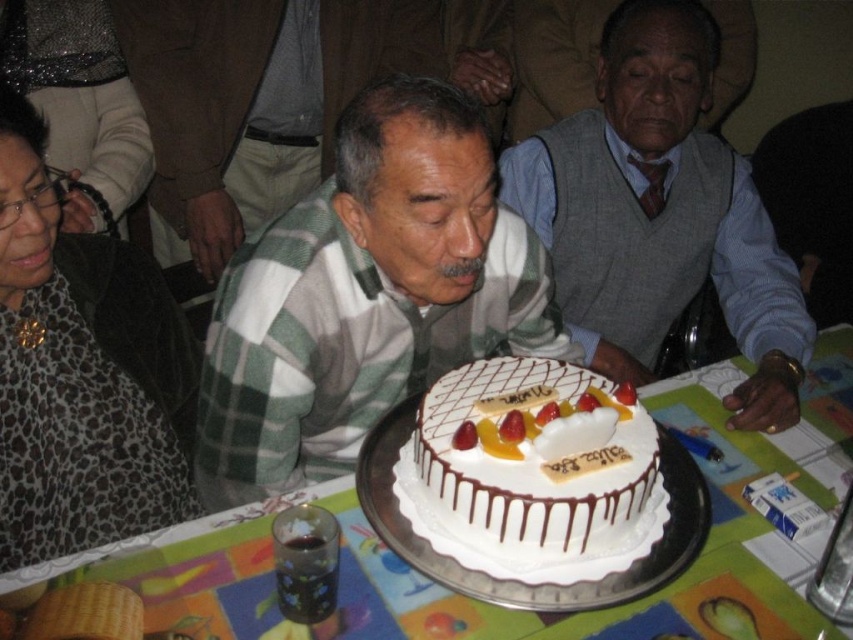
Is point (498, 243) closer to camera compared to point (428, 417)?

That is False.

The image size is (853, 640). What do you see at coordinates (364, 296) in the screenshot?
I see `white matte sweater at center` at bounding box center [364, 296].

You are a GUI agent. You are given a task and a screenshot of the screen. Output one action in this format:
    pyautogui.click(x=<x>, y=<y>)
    Task: Click on the white matte sweater at center
    
    Given the screenshot: What is the action you would take?
    pyautogui.click(x=364, y=296)

Can you confirm if gray sweater vest at center is wider than leopard print scarf at upper left?

Yes, gray sweater vest at center is wider than leopard print scarf at upper left.

Is point (596, 164) closer to camera compared to point (91, 260)?

No, it is not.

I want to click on gray sweater vest at center, so click(660, 216).

Does white textured sweater at center have a lesser width compared to white frosted cake at center?

In fact, white textured sweater at center might be wider than white frosted cake at center.

Does white textured sweater at center come behind white frosted cake at center?

Yes, it is.

Locate an element on the screen. This screenshot has height=640, width=853. white textured sweater at center is located at coordinates (280, 97).